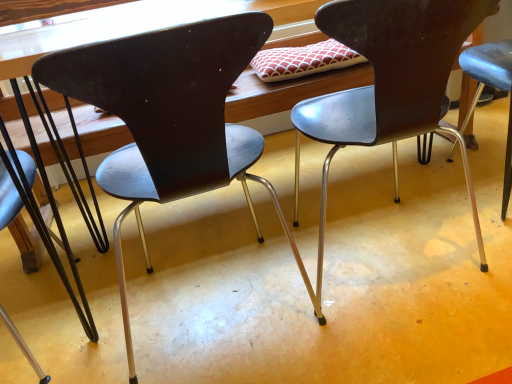
At what (x,y) coordinates should I click in order to perform the action: click on free space to the right of metallic dark brown chair at left, which is the 1th chair in left-to-right order. Please return your answer as a coordinate pair (x, y). The width and height of the screenshot is (512, 384). Looking at the image, I should click on (124, 298).